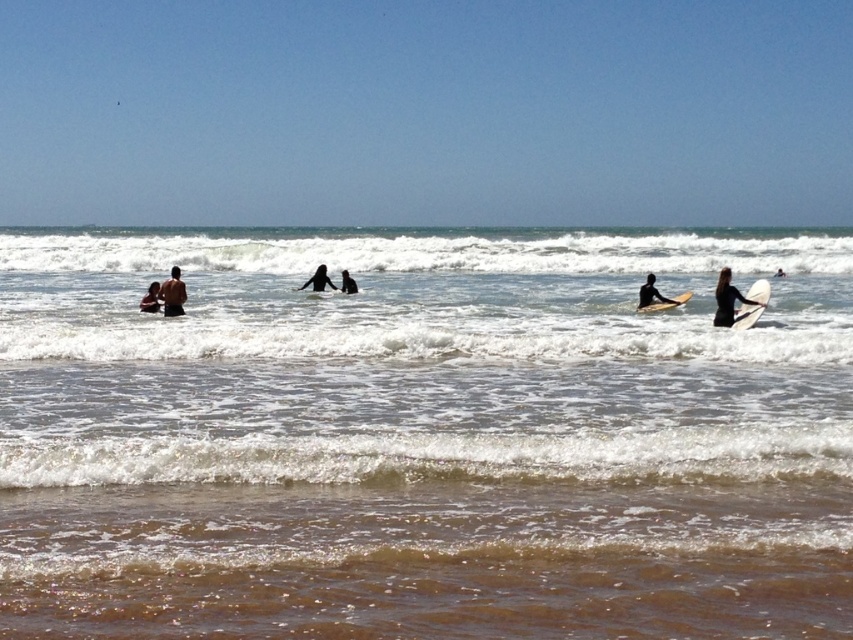
Question: Can you confirm if brown sandy beach at lower center is bigger than skinny man at center?

Choices:
 (A) no
 (B) yes

Answer: (A)

Question: Which point is farther to the camera?

Choices:
 (A) white matte surfboard at right
 (B) skinny man at center
 (C) brown sandy beach at lower center
 (D) black wetsuit surfer at center

Answer: (D)

Question: Which object is farther from the camera taking this photo?

Choices:
 (A) black wetsuit surfer at center
 (B) skinny man at center
 (C) black wetsuit at center

Answer: (A)

Question: Is clear water at center to the left of black wetsuit at center from the viewer's perspective?

Choices:
 (A) yes
 (B) no

Answer: (A)

Question: Which object appears farthest from the camera in this image?

Choices:
 (A) light brown smooth surfboard at right
 (B) black wetsuit at center
 (C) black matte surfboard at right

Answer: (B)

Question: Does black matte surfboard at right appear under light brown smooth surfboard at right?

Choices:
 (A) yes
 (B) no

Answer: (B)